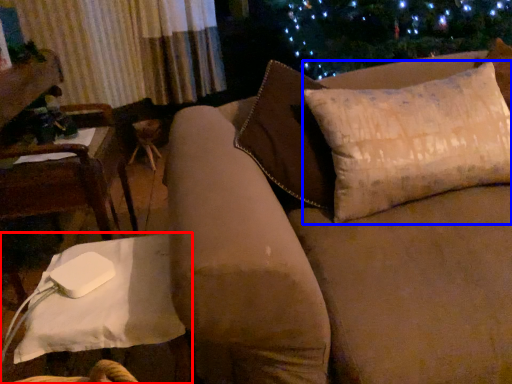
Question: Which object is further to the camera taking this photo, table (highlighted by a red box) or pillow (highlighted by a blue box)?

Choices:
 (A) table
 (B) pillow

Answer: (B)